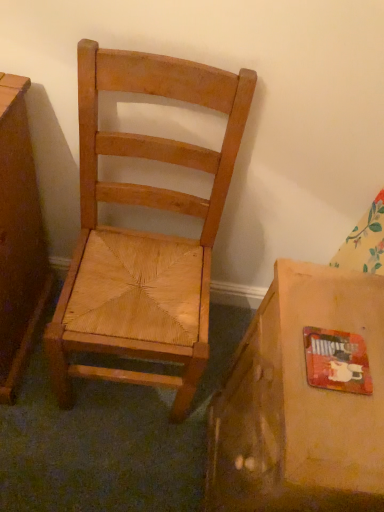
Question: Is matte cardboard box at lower right aimed at natural wood chair at center?

Choices:
 (A) no
 (B) yes

Answer: (A)

Question: Is matte cardboard box at lower right positioned with its back to natural wood chair at center?

Choices:
 (A) yes
 (B) no

Answer: (B)

Question: Considering the relative sizes of matte cardboard box at lower right and natural wood chair at center in the image provided, is matte cardboard box at lower right thinner than natural wood chair at center?

Choices:
 (A) yes
 (B) no

Answer: (A)

Question: Is matte cardboard box at lower right at the left side of natural wood chair at center?

Choices:
 (A) yes
 (B) no

Answer: (B)

Question: Is matte cardboard box at lower right to the right of natural wood chair at center from the viewer's perspective?

Choices:
 (A) yes
 (B) no

Answer: (A)

Question: Is the depth of matte cardboard box at lower right greater than that of natural wood chair at center?

Choices:
 (A) no
 (B) yes

Answer: (A)

Question: Considering the relative sizes of natural wood chair at center and matte cardboard box at lower right in the image provided, is natural wood chair at center thinner than matte cardboard box at lower right?

Choices:
 (A) no
 (B) yes

Answer: (A)

Question: Is natural wood chair at center not near matte cardboard box at lower right?

Choices:
 (A) yes
 (B) no

Answer: (B)

Question: From the image's perspective, is natural wood chair at center above matte cardboard box at lower right?

Choices:
 (A) no
 (B) yes

Answer: (B)

Question: Is natural wood chair at center aimed at matte cardboard box at lower right?

Choices:
 (A) yes
 (B) no

Answer: (B)

Question: Considering the relative sizes of natural wood chair at center and matte cardboard box at lower right in the image provided, is natural wood chair at center wider than matte cardboard box at lower right?

Choices:
 (A) no
 (B) yes

Answer: (B)

Question: From the image's perspective, is natural wood chair at center below matte cardboard box at lower right?

Choices:
 (A) yes
 (B) no

Answer: (B)

Question: Based on their sizes in the image, would you say natural wood chair at center is bigger or smaller than matte cardboard box at lower right?

Choices:
 (A) small
 (B) big

Answer: (B)